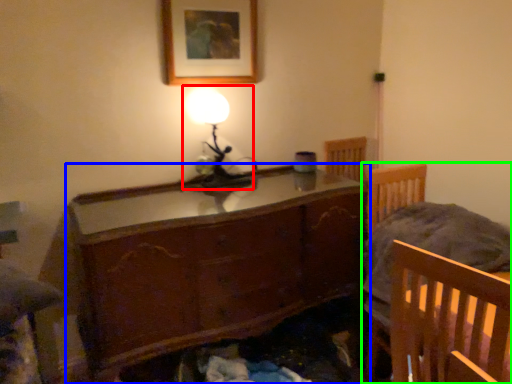
Question: Which is nearer to the table lamp (highlighted by a red box)? chest of drawers (highlighted by a blue box) or furniture (highlighted by a green box).

Choices:
 (A) chest of drawers
 (B) furniture

Answer: (A)